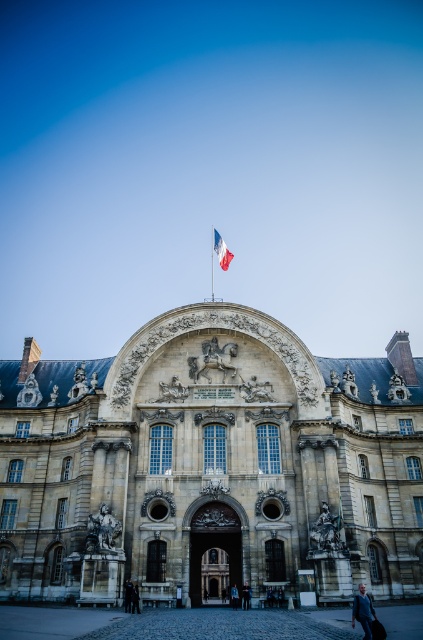
Image resolution: width=423 pixels, height=640 pixels. In order to click on stone textured palace at center in this screenshot , I will do `click(211, 465)`.

Who is positioned more to the left, metallic flag pole at center or dark brown leather jacket at center?

dark brown leather jacket at center

Is point (211, 268) more distant than point (139, 598)?

That is True.

Between point (211, 253) and point (139, 605), which one is positioned behind?

The point (211, 253) is more distant.

Where is `metallic flag pole at center`? Image resolution: width=423 pixels, height=640 pixels. metallic flag pole at center is located at coordinates (213, 260).

Is point (66, 506) in front of point (134, 609)?

No, (66, 506) is further to viewer.

Can you confirm if stone textured palace at center is smaller than dark brown leather jacket at center?

Actually, stone textured palace at center might be larger than dark brown leather jacket at center.

The image size is (423, 640). Describe the element at coordinates (211, 465) in the screenshot. I see `stone textured palace at center` at that location.

This screenshot has width=423, height=640. In order to click on stone textured palace at center in this screenshot , I will do `click(211, 465)`.